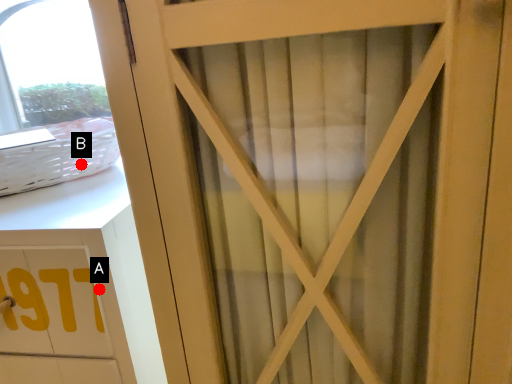
Question: Two points are circled on the image, labeled by A and B beside each circle. Which point is closer to the camera?

Choices:
 (A) A is closer
 (B) B is closer

Answer: (A)